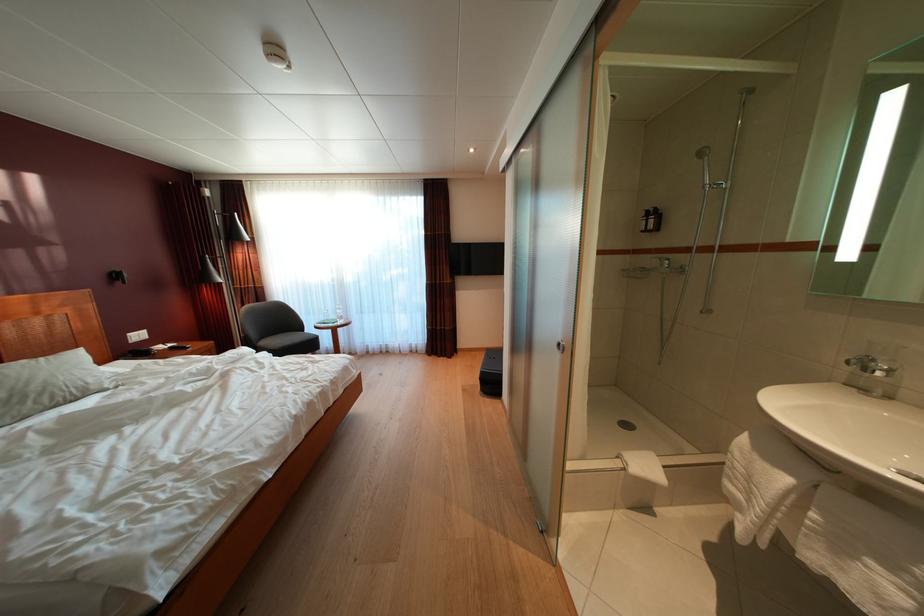
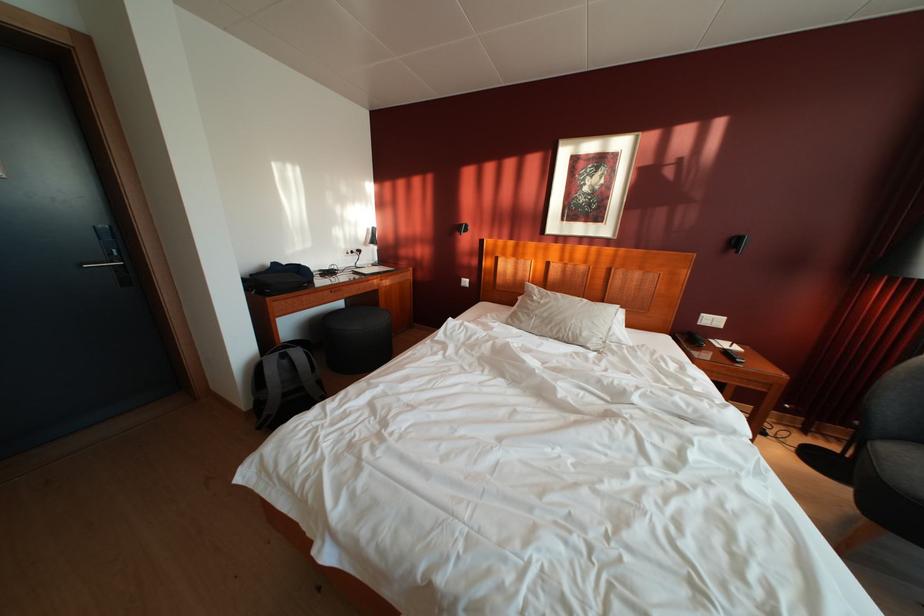
Find the pixel in the second image that matches [148,342] in the first image.

(721, 326)